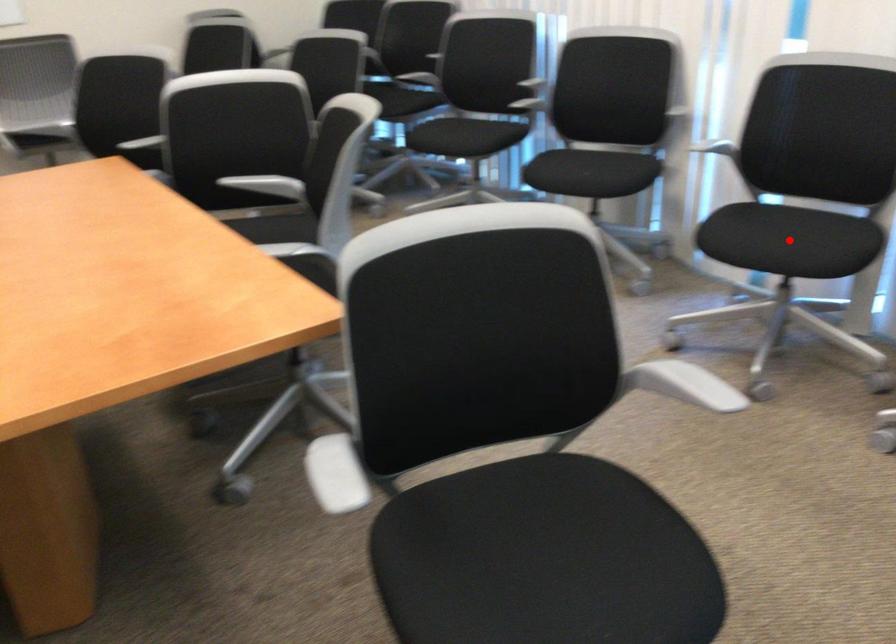
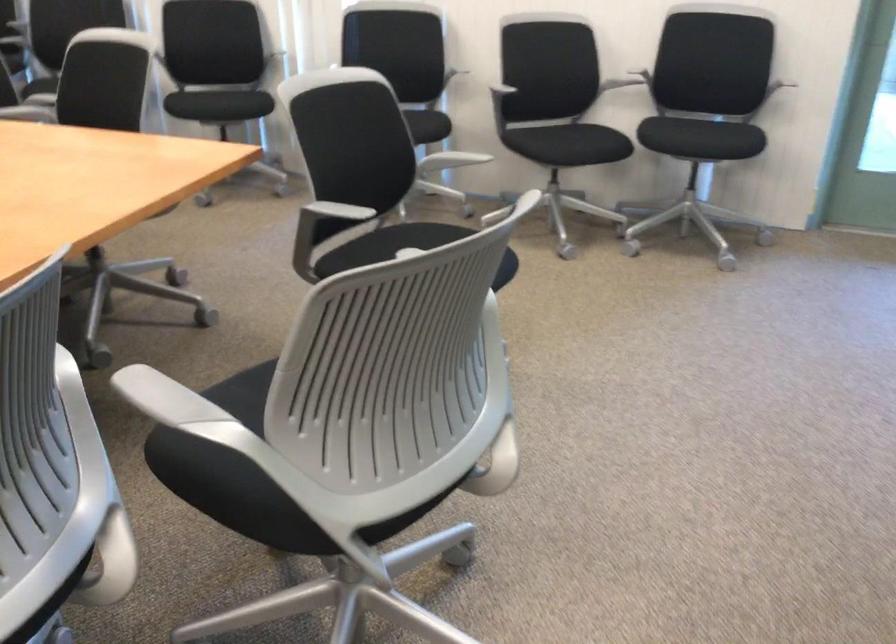
Question: I am providing you with two images of the same scene from different viewpoints. A red point is marked on the first image. At the location where the point appears in image 1, is it still visible in image 2?

Choices:
 (A) Yes
 (B) No

Answer: (B)